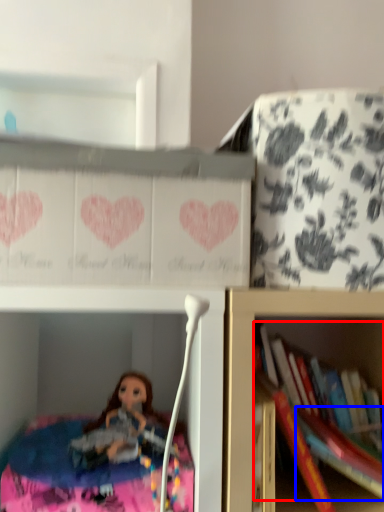
Question: Among these objects, which one is nearest to the camera, book (highlighted by a red box) or book (highlighted by a blue box)?

Choices:
 (A) book
 (B) book

Answer: (B)